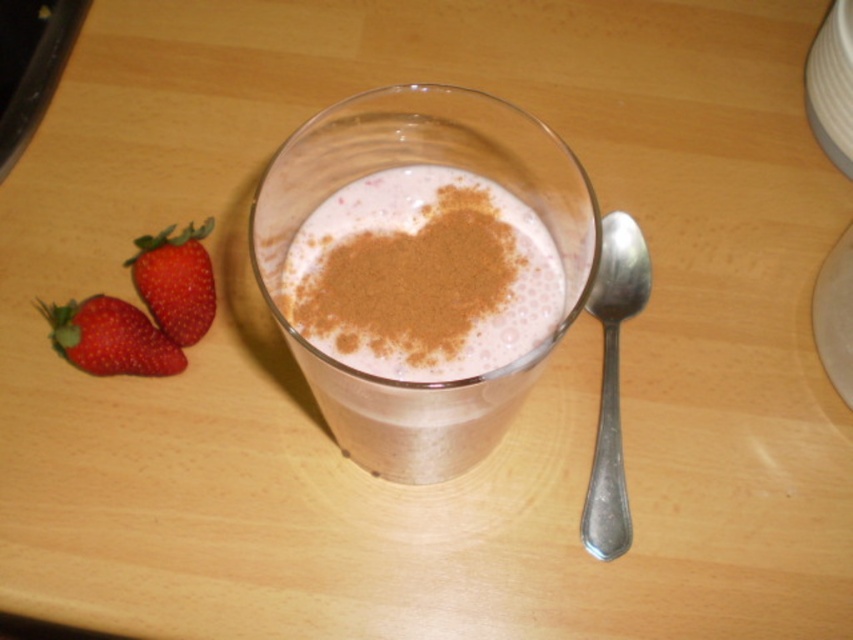
Question: Is silver metallic spoon at right bigger than red matte strawberry at left?

Choices:
 (A) yes
 (B) no

Answer: (A)

Question: Is smoothie with cinnamon at center to the left of red matte strawberry at left from the viewer's perspective?

Choices:
 (A) no
 (B) yes

Answer: (A)

Question: Can you confirm if smoothie with cinnamon at center is positioned to the left of red matte strawberry at left?

Choices:
 (A) yes
 (B) no

Answer: (B)

Question: Which point appears farthest from the camera in this image?

Choices:
 (A) (612, 257)
 (B) (173, 339)

Answer: (A)

Question: Which object is farther from the camera taking this photo?

Choices:
 (A) red matte strawberry at left
 (B) smoothie with cinnamon at center
 (C) silver metallic spoon at right

Answer: (A)

Question: Which of the following is the closest to the observer?

Choices:
 (A) smoothie with cinnamon at center
 (B) red glossy strawberry at lower left
 (C) red matte strawberry at left

Answer: (A)